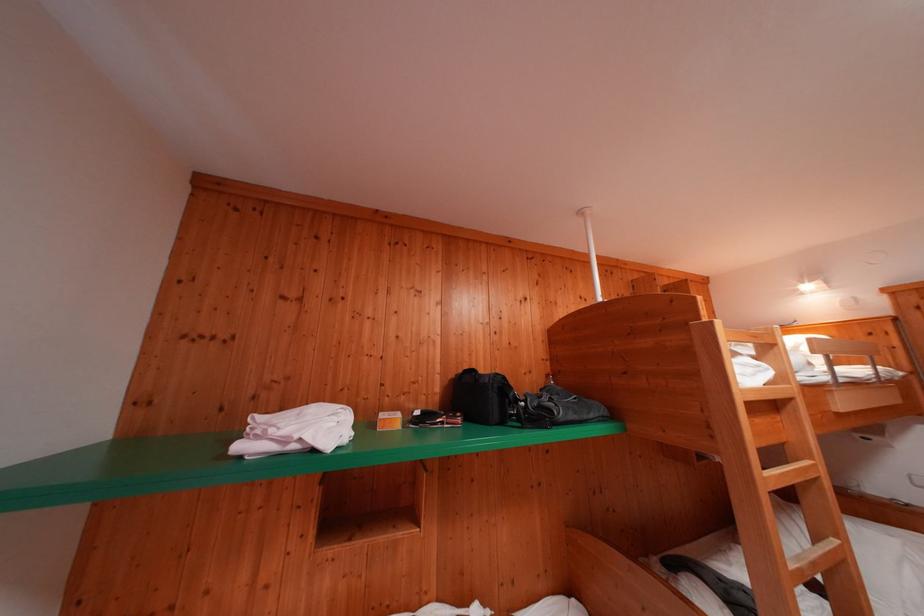
Where is `wooden ladder rung`? wooden ladder rung is located at coordinates (820, 546).